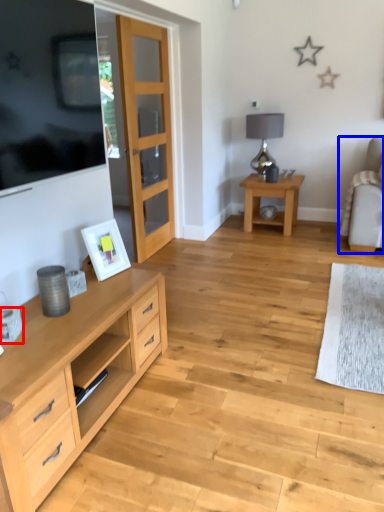
Question: Which object appears farthest to the camera in this image, coffee cup (highlighted by a red box) or chair (highlighted by a blue box)?

Choices:
 (A) coffee cup
 (B) chair

Answer: (B)